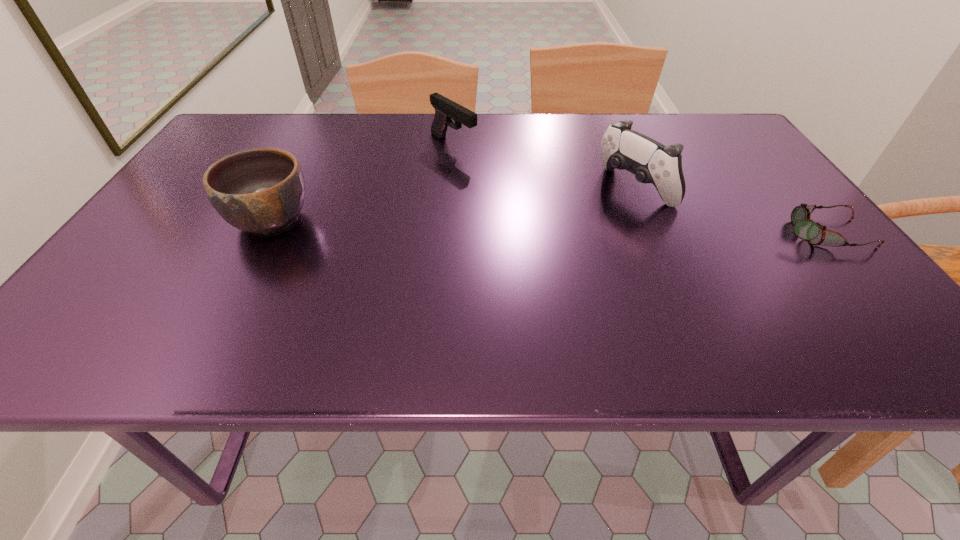
You are a GUI agent. You are given a task and a screenshot of the screen. Output one action in this format:
    pyautogui.click(x=<x>, y=<y>)
    Task: Click on the bowl
    This screenshot has height=540, width=960.
    Given the screenshot: What is the action you would take?
    pyautogui.click(x=262, y=190)

This screenshot has height=540, width=960. I want to click on spectacles, so click(x=804, y=228).

Locate an element on the screen. This screenshot has height=540, width=960. the shortest object is located at coordinates (804, 228).

This screenshot has height=540, width=960. I want to click on control, so click(650, 161).

Locate an element on the screen. This screenshot has height=540, width=960. the third object from right to left is located at coordinates (445, 109).

This screenshot has height=540, width=960. I want to click on pistol, so click(445, 109).

Image resolution: width=960 pixels, height=540 pixels. In order to click on vacant space located 0.230m on the right of the bowl in this screenshot , I will do `click(417, 220)`.

Locate an element on the screen. vacant space located 0.070m on the front-facing side of the third object from left to right is located at coordinates (589, 215).

Identify the location of free space located 0.400m on the front-facing side of the third object from left to right. (472, 280).

Where is `free space located on the front-facing side of the third object from left to right`? free space located on the front-facing side of the third object from left to right is located at coordinates (558, 233).